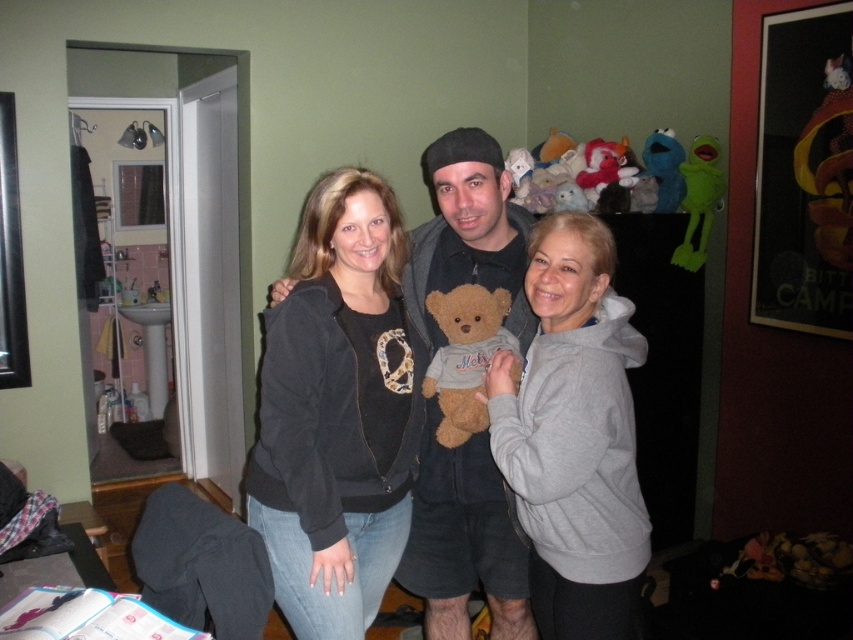
Question: Can you confirm if black matte jacket at center is bigger than blue plush toy at upper right?

Choices:
 (A) no
 (B) yes

Answer: (B)

Question: Which of the following is the farthest from the observer?

Choices:
 (A) black matte jacket at center
 (B) brown plush teddy bear at center
 (C) soft gray hoodie at center
 (D) gray fleece sweatshirt at center

Answer: (B)

Question: Which point appears farthest from the camera in this image?

Choices:
 (A) (683, 180)
 (B) (450, 369)
 (C) (612, 406)

Answer: (A)

Question: Which point is farther to the camera?

Choices:
 (A) brown plush teddy bear at center
 (B) blue plush toy at upper right
 (C) soft gray hoodie at center

Answer: (B)

Question: Does soft gray hoodie at center appear on the right side of blue plush toy at upper right?

Choices:
 (A) no
 (B) yes

Answer: (A)

Question: Is gray fleece sweatshirt at center to the left of green rubber frog at upper right from the viewer's perspective?

Choices:
 (A) yes
 (B) no

Answer: (A)